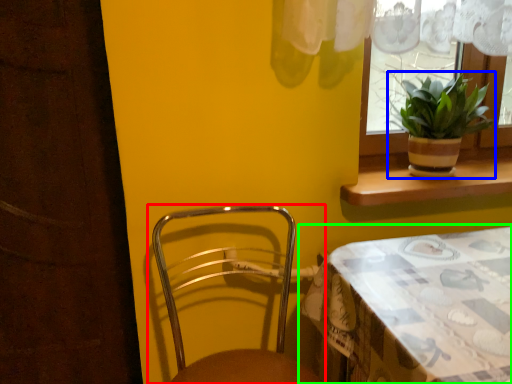
Question: Based on their relative distances, which object is nearer to chair (highlighted by a red box)? Choose from houseplant (highlighted by a blue box) and table (highlighted by a green box).

Choices:
 (A) houseplant
 (B) table

Answer: (B)